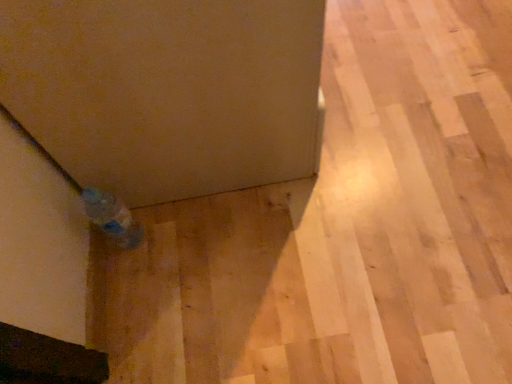
Measure the distance between point (x=92, y=195) and camera.

Point (x=92, y=195) and camera are 30.20 inches apart.

Find the location of a particular element. Image resolution: width=512 pixels, height=384 pixels. blue plastic bottle at lower left is located at coordinates (112, 218).

The width and height of the screenshot is (512, 384). What do you see at coordinates (112, 218) in the screenshot?
I see `blue plastic bottle at lower left` at bounding box center [112, 218].

Where is `blue plastic bottle at lower left`? This screenshot has width=512, height=384. blue plastic bottle at lower left is located at coordinates (112, 218).